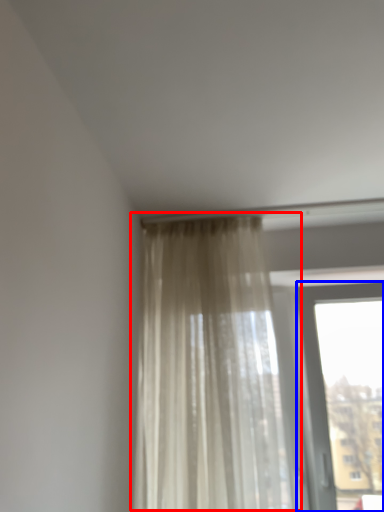
Question: Which object is further to the camera taking this photo, curtain (highlighted by a red box) or window (highlighted by a blue box)?

Choices:
 (A) curtain
 (B) window

Answer: (B)